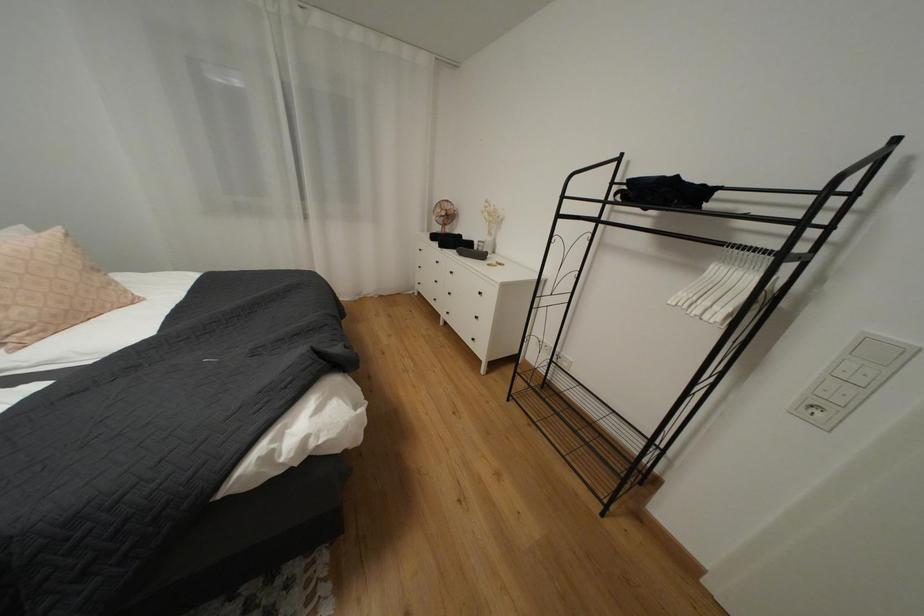
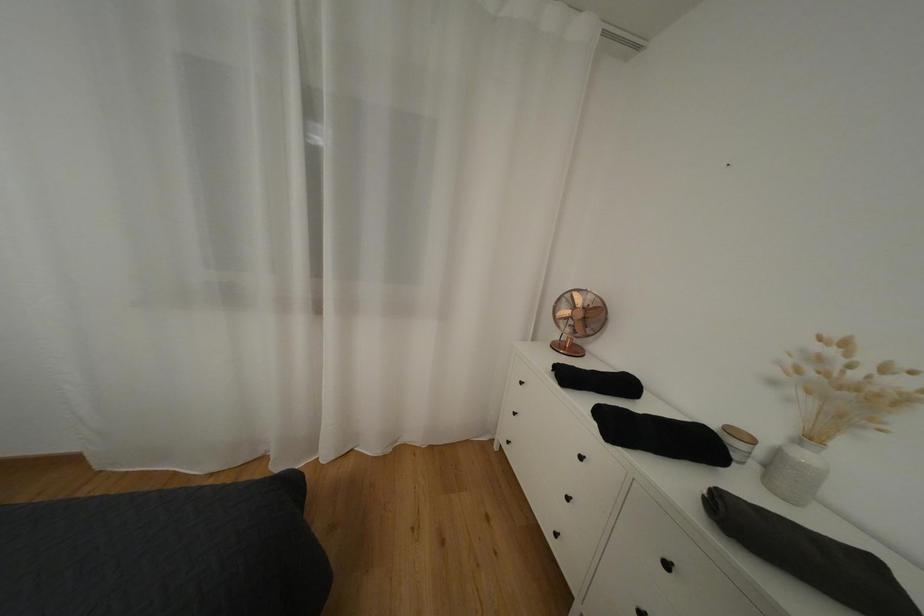
What movement of the cameraman would produce the second image?

The cameraman walked toward left, forward.